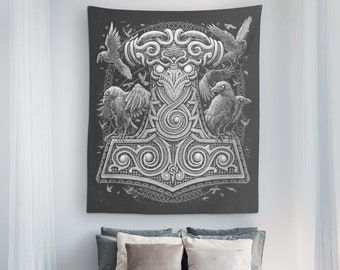
At what (x,y) coordinates should I click in order to perform the action: click on pillow. Please return your answer as a coordinate pair (x, y). The image size is (340, 270). Looking at the image, I should click on (210, 251).